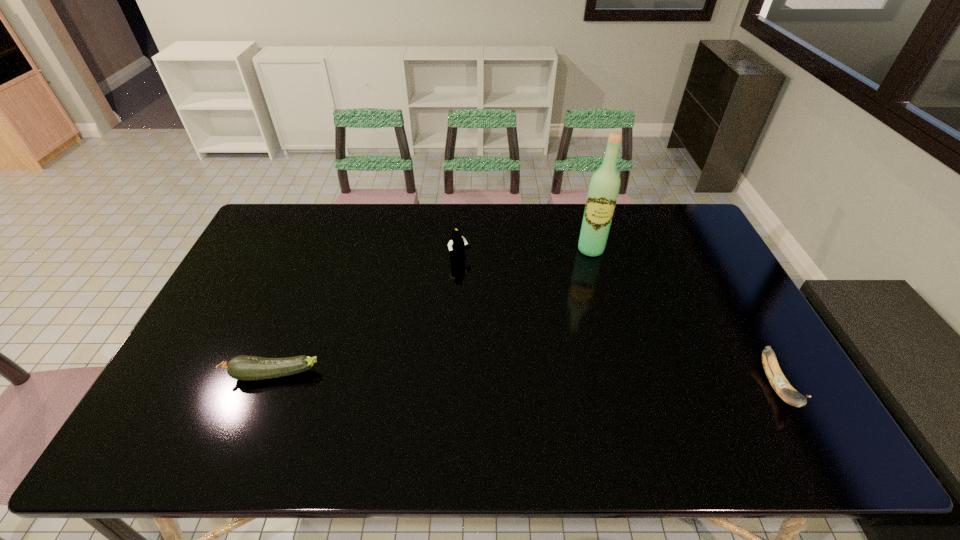
Find the location of a particular element. free spot on the desktop that is between the zucchini and the third tallest object and is positioned on the front-facing side of the third object from right to left is located at coordinates (565, 381).

Where is `free space on the desktop that is between the zucchini and the third tallest object and is positioned on the front-facing side of the third object from left to right`? Image resolution: width=960 pixels, height=540 pixels. free space on the desktop that is between the zucchini and the third tallest object and is positioned on the front-facing side of the third object from left to right is located at coordinates (587, 382).